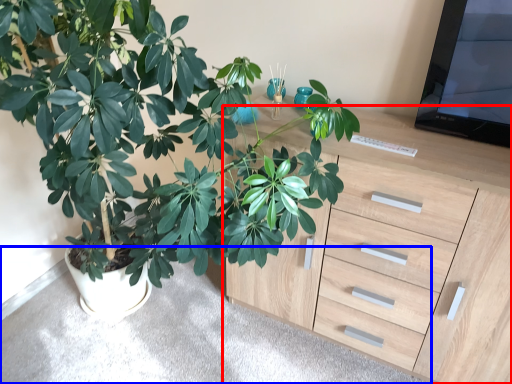
Question: Which object appears farthest to the camera in this image, chest of drawers (highlighted by a red box) or gray (highlighted by a blue box)?

Choices:
 (A) chest of drawers
 (B) gray

Answer: (B)